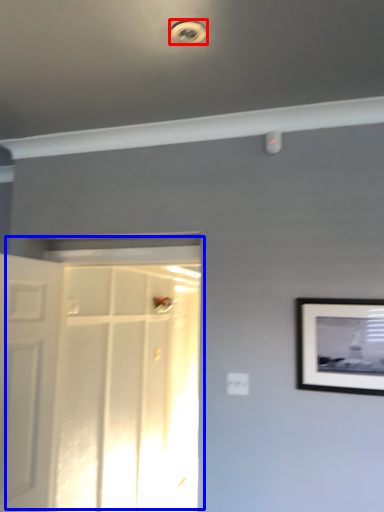
Question: Which object appears farthest to the camera in this image, droplight (highlighted by a red box) or door (highlighted by a blue box)?

Choices:
 (A) droplight
 (B) door

Answer: (B)